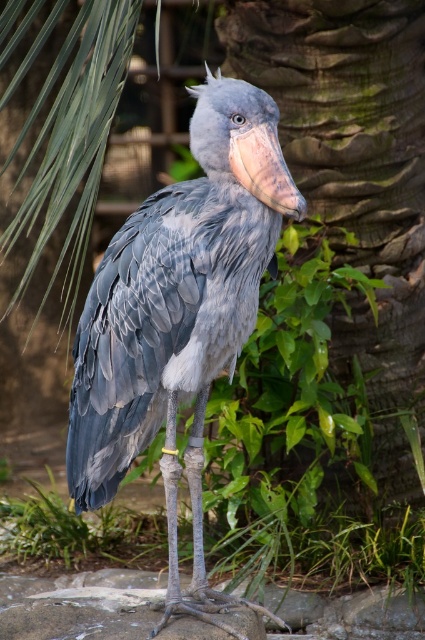
You are a wildlife photographer aiming to capture the gray matte bird at center in the image. Based on its position, where should you focus your camera to ensure the bird is centered in the frame?

The gray matte bird at center is located at the coordinates point (178,316), so you should focus your camera at that point to center it in the frame.

You are a photographer trying to capture the shoebill stork in the image. You notice two points marked on the image at coordinates point [150,438] and point [360,202]. Which point is closer to your camera lens?

Point [150,438] is closer to the camera than point [360,202].